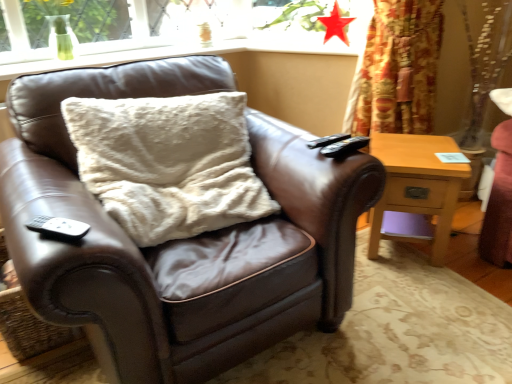
Question: Is matte red star at upper center in front of or behind black plastic remote at upper right, the 2th remote in the bottom-to-top sequence, in the image?

Choices:
 (A) front
 (B) behind

Answer: (B)

Question: Considering the positions of point click(325, 19) and point click(346, 135), is point click(325, 19) closer or farther from the camera than point click(346, 135)?

Choices:
 (A) farther
 (B) closer

Answer: (A)

Question: Estimate the real-world distances between objects in this image. Which object is farther from the matte red star at upper center?

Choices:
 (A) brown leather chair at center
 (B) black matte remote at lower left, marked as the 1th remote in a front-to-back arrangement
 (C) light wood/texture nightstand at right
 (D) fuzzy white pillow at center
 (E) black plastic remote at upper right, acting as the first remote starting from the right

Answer: (B)

Question: Which is nearer to the matte red star at upper center?

Choices:
 (A) black plastic remote at upper right, acting as the first remote starting from the right
 (B) fuzzy white pillow at center
 (C) brown leather chair at center
 (D) light wood/texture nightstand at right
 (E) black matte remote at lower left, the 2th remote when ordered from back to front

Answer: (D)